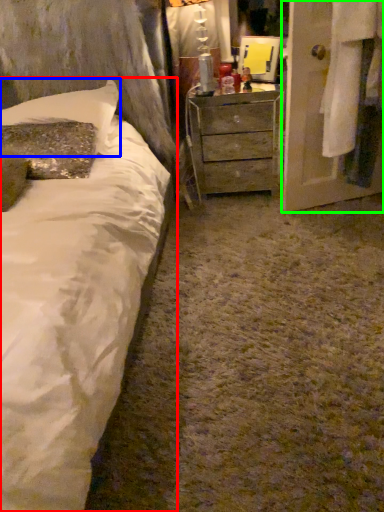
Question: Estimate the real-world distances between objects in this image. Which object is closer to bed (highlighted by a red box), pillow (highlighted by a blue box) or armoire (highlighted by a green box)?

Choices:
 (A) pillow
 (B) armoire

Answer: (A)